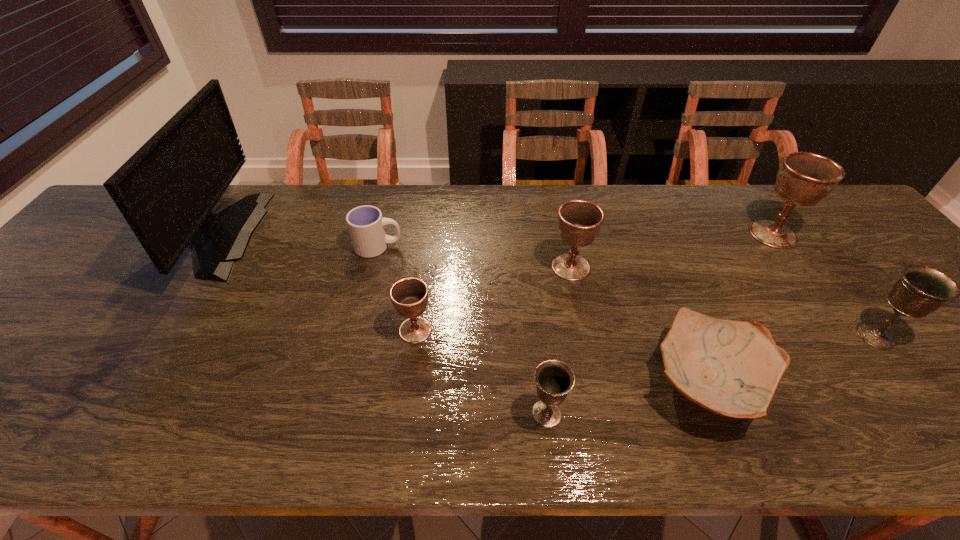
At what (x,y) coordinates should I click in order to perform the action: click on the leftmost object. Please return your answer as a coordinate pair (x, y). The width and height of the screenshot is (960, 540). Looking at the image, I should click on (166, 190).

Locate an element on the screen. the tallest object is located at coordinates (166, 190).

Where is `the tallest chalice`? the tallest chalice is located at coordinates (804, 179).

In order to click on the seventh shortest object in this screenshot , I will do `click(804, 179)`.

The width and height of the screenshot is (960, 540). Identify the location of the right bronze chalice. (921, 290).

This screenshot has height=540, width=960. In order to click on the bigger bronze chalice in this screenshot , I will do `click(921, 290)`.

Identify the location of the second farthest brown chalice. This screenshot has width=960, height=540. (579, 221).

Where is `the second biggest brown chalice`? the second biggest brown chalice is located at coordinates (579, 221).

The width and height of the screenshot is (960, 540). What are the coordinates of `the third object from left to right` in the screenshot? It's located at (409, 296).

Where is `the leftmost chalice`? Image resolution: width=960 pixels, height=540 pixels. the leftmost chalice is located at coordinates point(409,296).